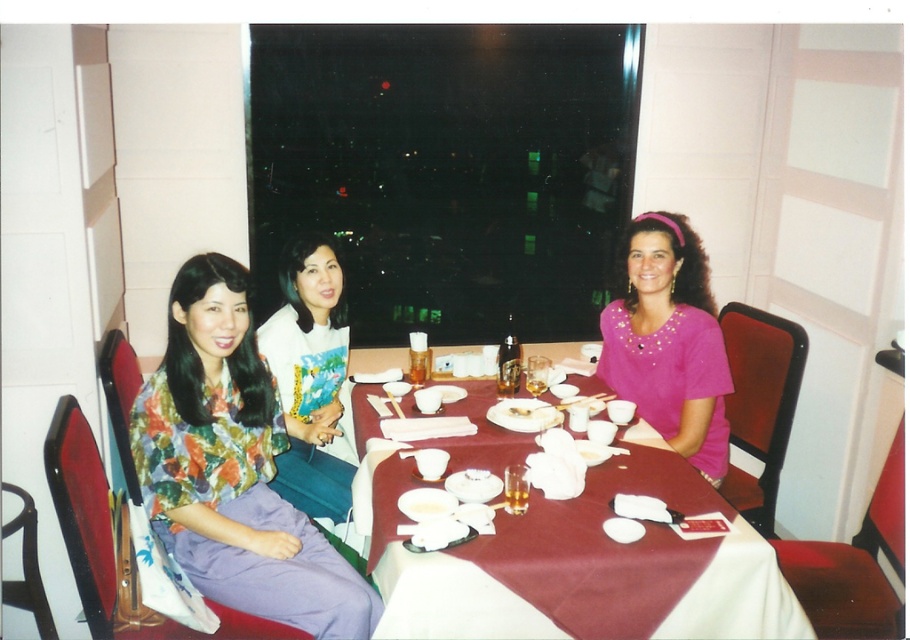
Between floral fabric blouse at center and pink satin blouse at center, which one appears on the right side from the viewer's perspective?

Positioned to the right is pink satin blouse at center.

Is floral fabric blouse at center smaller than pink satin blouse at center?

No, floral fabric blouse at center is not smaller than pink satin blouse at center.

Between point (258, 544) and point (641, 298), which one is positioned in front?

Point (258, 544) is more forward.

The height and width of the screenshot is (640, 910). Find the location of `floral fabric blouse at center`. floral fabric blouse at center is located at coordinates (234, 467).

Does maroon fabric table at center appear under pink satin blouse at center?

Correct, maroon fabric table at center is located below pink satin blouse at center.

Between point (484, 618) and point (678, 300), which one is positioned behind?

The point (678, 300) is more distant.

Find the location of a particular element. This screenshot has width=910, height=640. maroon fabric table at center is located at coordinates (582, 566).

How distant is maroon fabric table at center from floral fabric blouse at center?

The distance of maroon fabric table at center from floral fabric blouse at center is 17.04 inches.

Can you confirm if maroon fabric table at center is wider than floral fabric blouse at center?

Indeed, maroon fabric table at center has a greater width compared to floral fabric blouse at center.

Is point (676, 484) behind point (211, 369)?

That is True.

Where is `maroon fabric table at center`? The width and height of the screenshot is (910, 640). maroon fabric table at center is located at coordinates (582, 566).